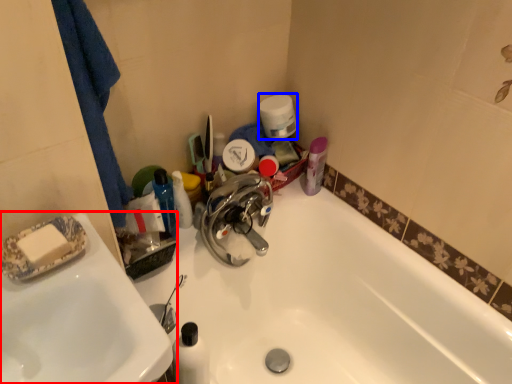
Question: Which object is further to the camera taking this photo, sink (highlighted by a red box) or toilet paper (highlighted by a blue box)?

Choices:
 (A) sink
 (B) toilet paper

Answer: (B)